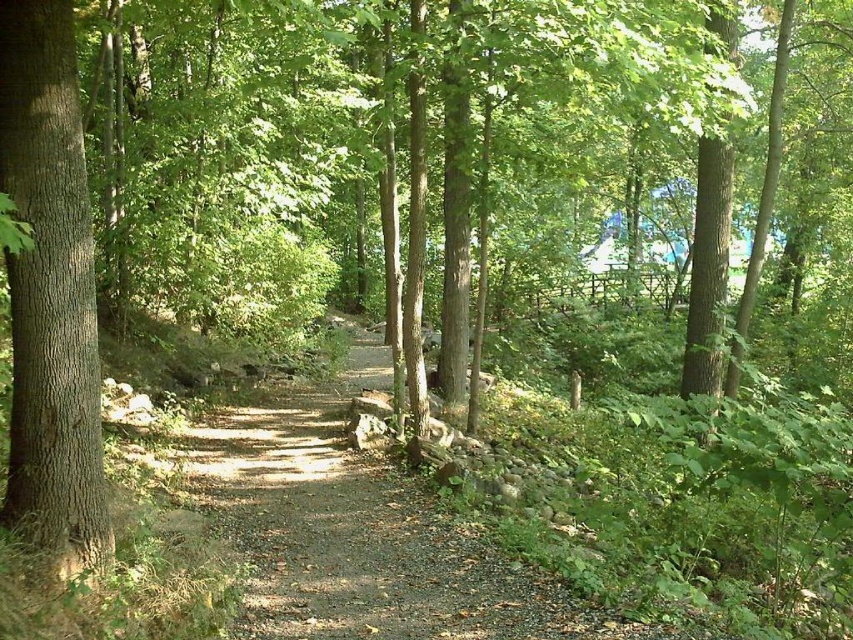
Question: Can you confirm if dirt path at center is bigger than smooth brown tree trunk at left?

Choices:
 (A) yes
 (B) no

Answer: (A)

Question: In this image, where is dirt path at center located relative to smooth brown tree trunk at left?

Choices:
 (A) left
 (B) right

Answer: (B)

Question: Which point is farther from the camera taking this photo?

Choices:
 (A) (341, 611)
 (B) (32, 394)

Answer: (A)

Question: Can you confirm if dirt path at center is bigger than smooth brown tree trunk at left?

Choices:
 (A) no
 (B) yes

Answer: (B)

Question: Which point appears closest to the camera in this image?

Choices:
 (A) (461, 532)
 (B) (65, 481)

Answer: (B)